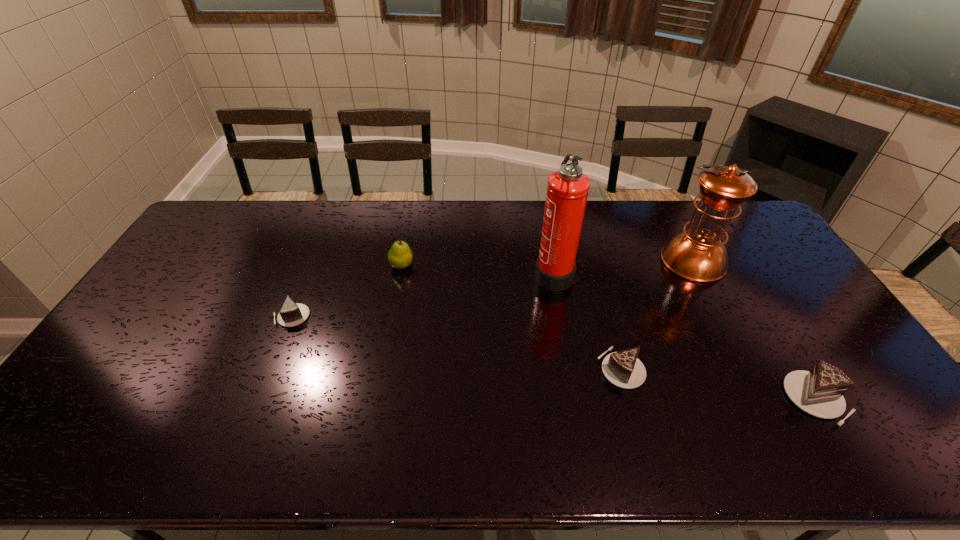
Find the location of a particular element. free space that satisfies the following two spatial constraints: 1. on the front-facing side of the tallest object; 2. on the front side of the shortest object is located at coordinates (561, 316).

At what (x,y) coordinates should I click in order to perform the action: click on blank space that satisfies the following two spatial constraints: 1. on the back side of the pear; 2. on the left side of the shortest object. Please return your answer as a coordinate pair (x, y). Image resolution: width=960 pixels, height=540 pixels. Looking at the image, I should click on (312, 265).

Locate an element on the screen. This screenshot has width=960, height=540. free space that satisfies the following two spatial constraints: 1. on the front-facing side of the fourth object from right to left; 2. on the back side of the third shortest object is located at coordinates (575, 399).